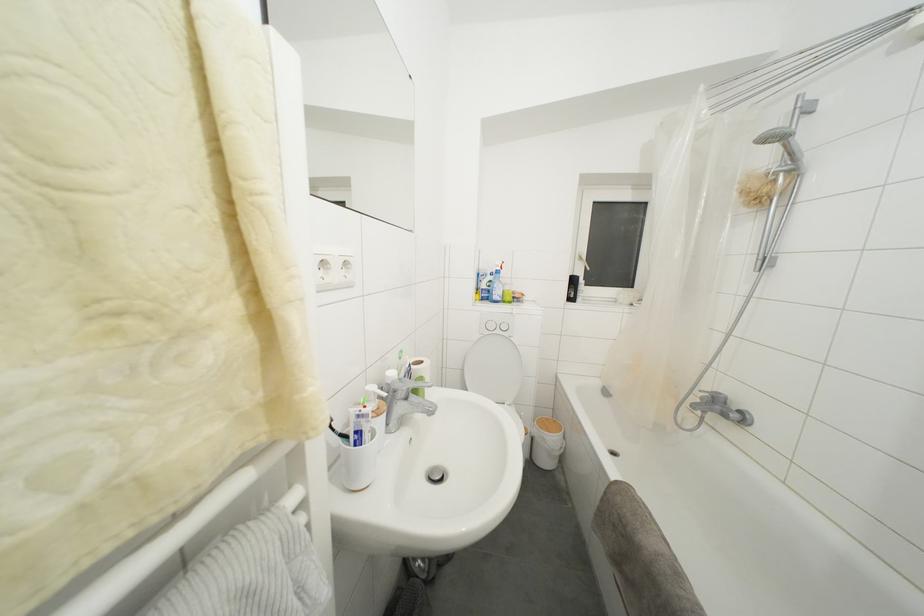
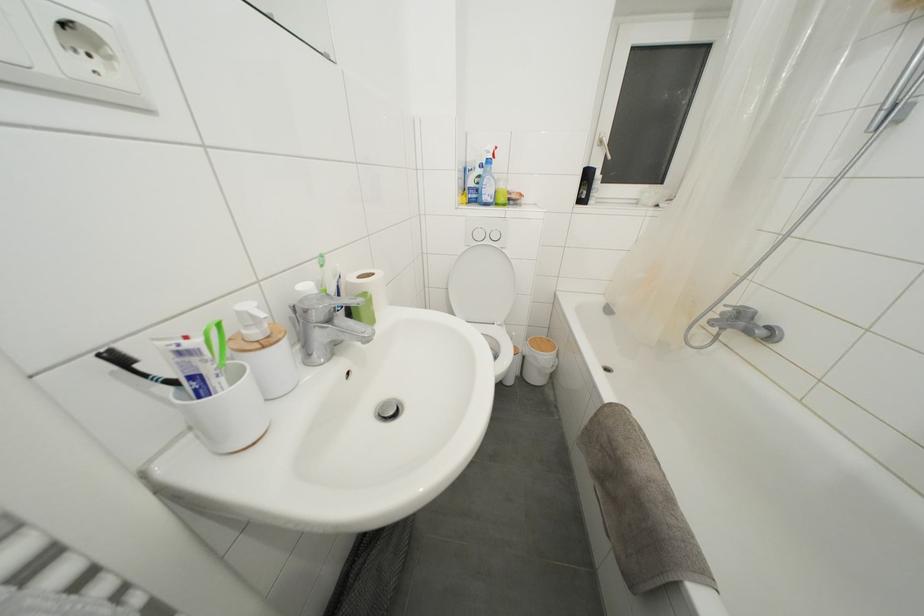
What movement of the cameraman would produce the second image?

The cameraman walked toward right, forward.